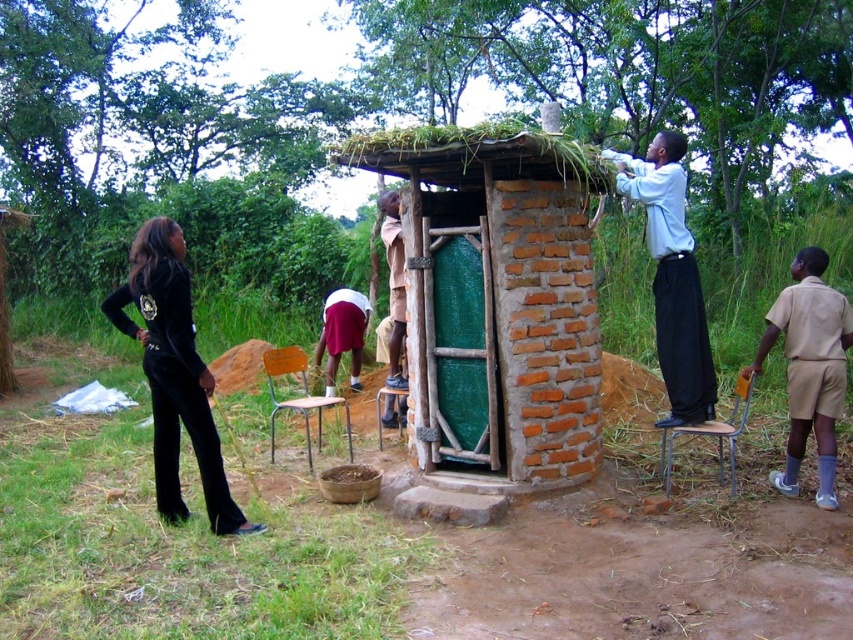
In the scene shown: You are standing in front of the brick structure and notice the green mesh door at center. Based on its position, can you determine if the door is positioned higher or lower than the thatched roof?

The green mesh door at center is located at point coordinates, but without specific elevation data from the scene description, I cannot determine if it is higher or lower than the thatched roof. The scene description mentions the door is at center but does not provide vertical positioning details compared to the roof.

You are observing the construction site and need to determine clothing sizes. Which person is wearing a larger shirt, the one in the light blue shirt at upper right or the one in the beige uniform at right?

The light blue shirt at upper right is bigger than the beige uniform at right, so the person in the light blue shirt at upper right is wearing a larger shirt.

You are observing a construction site for a brick structure. You notice two workers dressed in a light blue shirt at upper right and a beige uniform at right. Which worker is located more to the left side?

The light blue shirt at upper right is positioned on the left side of beige uniform at right, so the worker in the light blue shirt at upper right is more to the left.